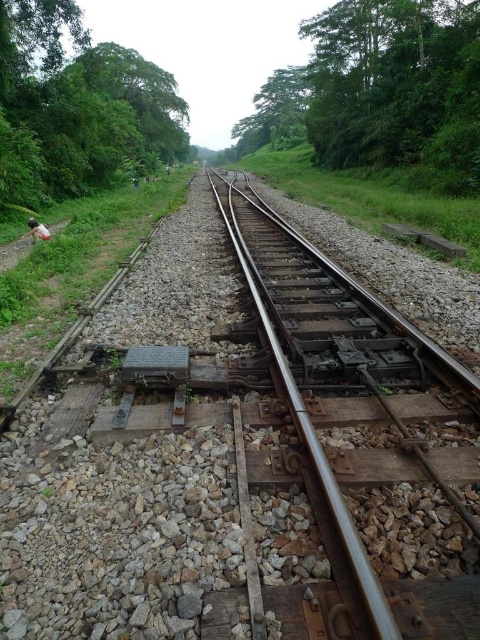
You are a photographer standing at the scene. You want to take a photo of the white fabric person at left and the rusty metal train track at center. Based on their positions, which object is closer to the camera?

The white fabric person at left is closer to the camera because the rusty metal train track at center is below it.

You are a photographer standing at the end of the railway tracks. You want to capture a photo where the rusty metal train track at center and the white fabric person at left are both visible. Considering their heights, which object will appear taller in the photo?

The rusty metal train track at center will appear taller in the photo because it has a greater height compared to the white fabric person at left.

You are standing near the railway tracks in the image. If you want to cross the rusty metal train track at center safely, what should you do first?

You should ensure there is no approaching train before crossing the rusty metal train track at center. The distance between you and the track is 1.74 meters, so you have enough space to safely cross if clear.